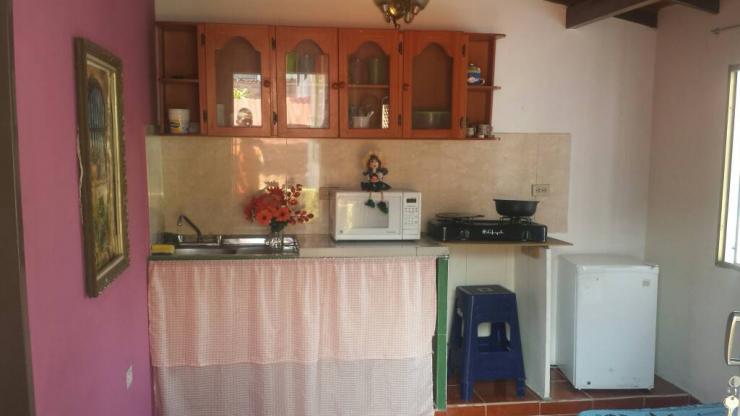
Image resolution: width=740 pixels, height=416 pixels. In order to click on curtain in this screenshot , I will do (260, 311).